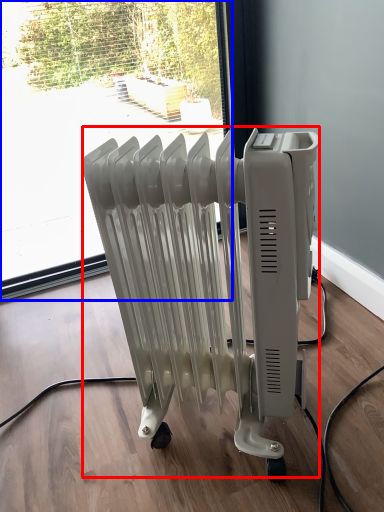
Question: Which object is further to the camera taking this photo, bath heater (highlighted by a red box) or window (highlighted by a blue box)?

Choices:
 (A) bath heater
 (B) window

Answer: (B)